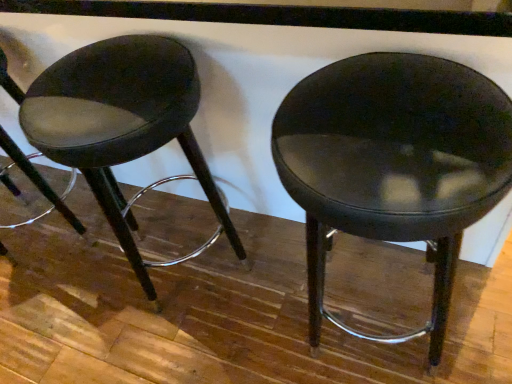
Question: Could matte black stool at center be considered to be inside matte black stool at left?

Choices:
 (A) no
 (B) yes

Answer: (A)

Question: Is matte black stool at left completely or partially outside of matte black stool at center?

Choices:
 (A) no
 (B) yes

Answer: (B)

Question: Is matte black stool at left wider than matte black stool at center?

Choices:
 (A) yes
 (B) no

Answer: (B)

Question: From a real-world perspective, is matte black stool at left on top of matte black stool at center?

Choices:
 (A) no
 (B) yes

Answer: (A)

Question: Does matte black stool at left appear on the left side of matte black stool at center?

Choices:
 (A) no
 (B) yes

Answer: (B)

Question: Is matte black stool at left aimed at matte black stool at center?

Choices:
 (A) yes
 (B) no

Answer: (B)

Question: Is matte black stool at center facing away from matte black stool at left?

Choices:
 (A) no
 (B) yes

Answer: (A)

Question: Is matte black stool at center closer to the viewer compared to matte black stool at left?

Choices:
 (A) yes
 (B) no

Answer: (A)

Question: Can you confirm if matte black stool at center is taller than matte black stool at left?

Choices:
 (A) yes
 (B) no

Answer: (A)

Question: Is matte black stool at left located within matte black stool at center?

Choices:
 (A) no
 (B) yes

Answer: (A)

Question: Considering the relative positions of matte black stool at center and matte black stool at left in the image provided, is matte black stool at center to the left of matte black stool at left from the viewer's perspective?

Choices:
 (A) no
 (B) yes

Answer: (A)

Question: From the image's perspective, is matte black stool at center under matte black stool at left?

Choices:
 (A) no
 (B) yes

Answer: (B)

Question: Is point (84, 81) closer or farther from the camera than point (445, 140)?

Choices:
 (A) closer
 (B) farther

Answer: (B)